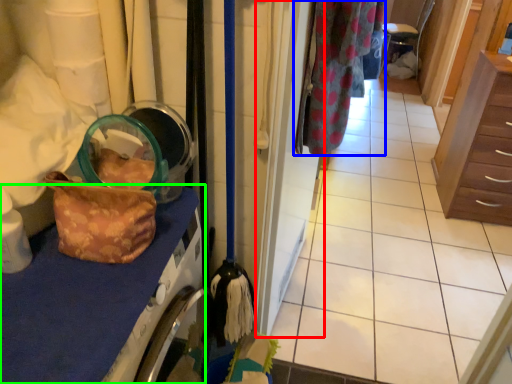
Question: Which is nearer to the door (highlighted by a red box)? clothing (highlighted by a blue box) or counter top (highlighted by a green box).

Choices:
 (A) clothing
 (B) counter top

Answer: (A)